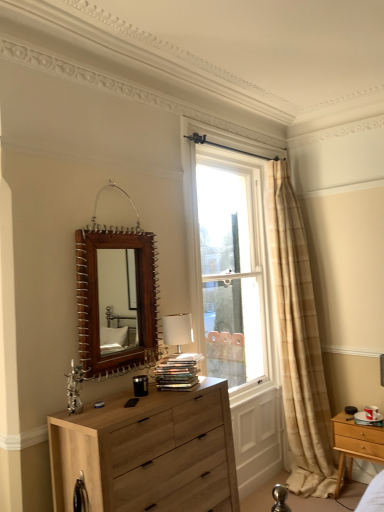
Question: From the image's perspective, is clear glass window at center below beige plaid curtain at right?

Choices:
 (A) no
 (B) yes

Answer: (A)

Question: Does clear glass window at center come in front of beige plaid curtain at right?

Choices:
 (A) no
 (B) yes

Answer: (B)

Question: Does clear glass window at center have a greater height compared to beige plaid curtain at right?

Choices:
 (A) yes
 (B) no

Answer: (B)

Question: Can you confirm if clear glass window at center is smaller than beige plaid curtain at right?

Choices:
 (A) yes
 (B) no

Answer: (A)

Question: Considering the relative positions of clear glass window at center and beige plaid curtain at right in the image provided, is clear glass window at center behind beige plaid curtain at right?

Choices:
 (A) no
 (B) yes

Answer: (A)

Question: Relative to beige plaid curtain at right, is natural wood chest of drawers at lower left in front or behind?

Choices:
 (A) behind
 (B) front

Answer: (B)

Question: Is natural wood chest of drawers at lower left taller or shorter than beige plaid curtain at right?

Choices:
 (A) tall
 (B) short

Answer: (B)

Question: From a real-world perspective, is natural wood chest of drawers at lower left physically located above or below beige plaid curtain at right?

Choices:
 (A) above
 (B) below

Answer: (B)

Question: Is natural wood chest of drawers at lower left bigger or smaller than beige plaid curtain at right?

Choices:
 (A) small
 (B) big

Answer: (A)

Question: From a real-world perspective, relative to brown wooden mirror at upper center, is clear glass window at center vertically above or below?

Choices:
 (A) below
 (B) above

Answer: (A)

Question: Is clear glass window at center inside the boundaries of brown wooden mirror at upper center, or outside?

Choices:
 (A) outside
 (B) inside

Answer: (A)

Question: Is point (233, 230) positioned closer to the camera than point (96, 241)?

Choices:
 (A) closer
 (B) farther

Answer: (B)

Question: Looking at their shapes, would you say clear glass window at center is wider or thinner than brown wooden mirror at upper center?

Choices:
 (A) thin
 (B) wide

Answer: (B)

Question: From their relative heights in the image, would you say light wood/texture nightstand at lower right is taller or shorter than natural wood chest of drawers at lower left?

Choices:
 (A) short
 (B) tall

Answer: (A)

Question: Looking at their shapes, would you say light wood/texture nightstand at lower right is wider or thinner than natural wood chest of drawers at lower left?

Choices:
 (A) thin
 (B) wide

Answer: (A)